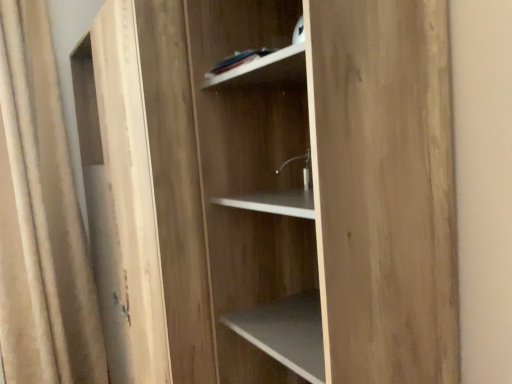
Question: Does beige fabric curtain at left turn towards light brown wood at center?

Choices:
 (A) no
 (B) yes

Answer: (A)

Question: Is beige fabric curtain at left at the right side of light brown wood at center?

Choices:
 (A) yes
 (B) no

Answer: (B)

Question: Is beige fabric curtain at left taller than light brown wood at center?

Choices:
 (A) no
 (B) yes

Answer: (B)

Question: Is beige fabric curtain at left thinner than light brown wood at center?

Choices:
 (A) no
 (B) yes

Answer: (B)

Question: Considering the relative sizes of beige fabric curtain at left and light brown wood at center in the image provided, is beige fabric curtain at left wider than light brown wood at center?

Choices:
 (A) no
 (B) yes

Answer: (A)

Question: In terms of height, does light brown wood at center look taller or shorter compared to beige fabric curtain at left?

Choices:
 (A) tall
 (B) short

Answer: (B)

Question: In terms of width, does light brown wood at center look wider or thinner when compared to beige fabric curtain at left?

Choices:
 (A) wide
 (B) thin

Answer: (A)

Question: Which is correct: light brown wood at center is inside beige fabric curtain at left, or outside of it?

Choices:
 (A) inside
 (B) outside

Answer: (B)

Question: Considering the relative positions of light brown wood at center and beige fabric curtain at left in the image provided, is light brown wood at center to the left or to the right of beige fabric curtain at left?

Choices:
 (A) left
 (B) right

Answer: (B)

Question: From a real-world perspective, is light brown wood at center above or below white matte shelf at upper center?

Choices:
 (A) above
 (B) below

Answer: (B)

Question: From the image's perspective, is light brown wood at center above or below white matte shelf at upper center?

Choices:
 (A) below
 (B) above

Answer: (A)

Question: Does point (435, 380) appear closer or farther from the camera than point (244, 82)?

Choices:
 (A) farther
 (B) closer

Answer: (B)

Question: Is light brown wood at center taller or shorter than white matte shelf at upper center?

Choices:
 (A) tall
 (B) short

Answer: (A)

Question: Do you think white matte shelf at upper center is within light brown wood at center, or outside of it?

Choices:
 (A) inside
 (B) outside

Answer: (A)

Question: Is white matte shelf at upper center to the left or to the right of light brown wood at center in the image?

Choices:
 (A) left
 (B) right

Answer: (A)